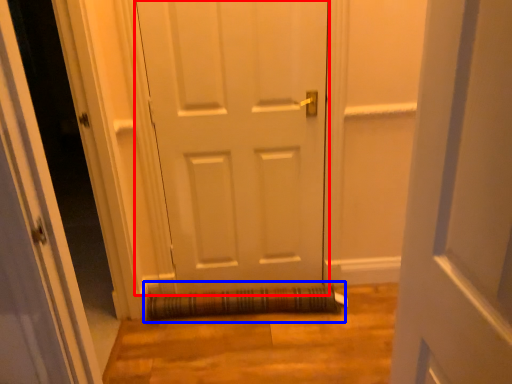
Question: Which point is closer to the camera, door (highlighted by a red box) or doormat (highlighted by a blue box)?

Choices:
 (A) door
 (B) doormat

Answer: (A)